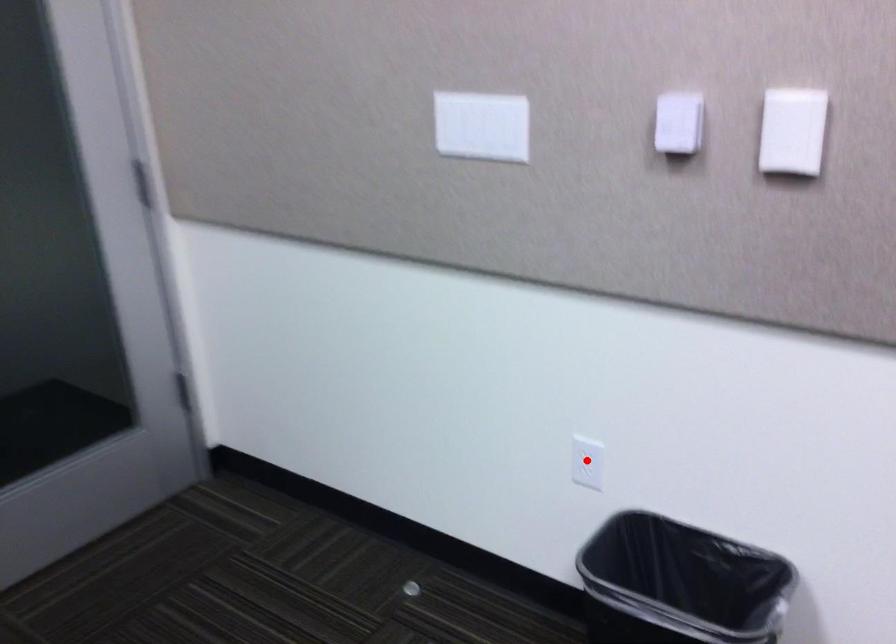
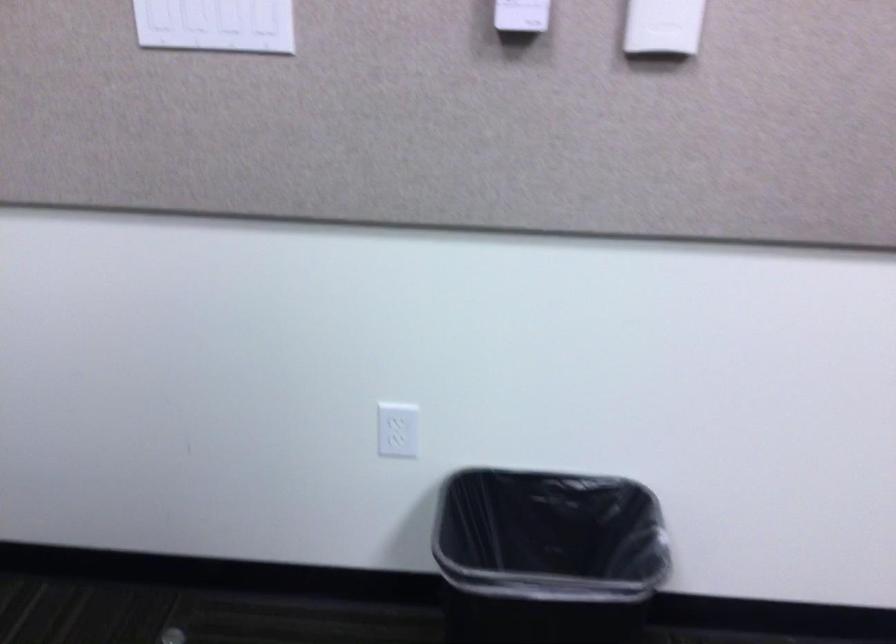
Locate, in the second image, the point that corresponds to the highlighted location in the first image.

(398, 430)